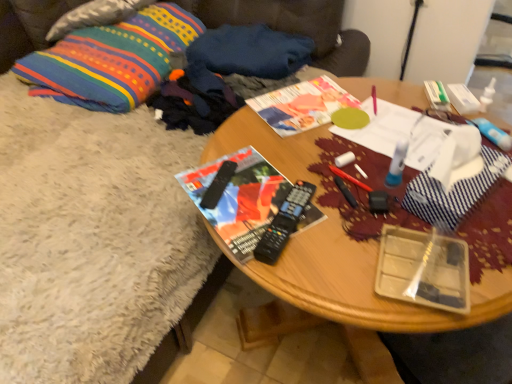
Locate an element on the screen. The height and width of the screenshot is (384, 512). vacant space to the right of black plastic remote control at center, the 1th remote control positioned from the left is located at coordinates (268, 195).